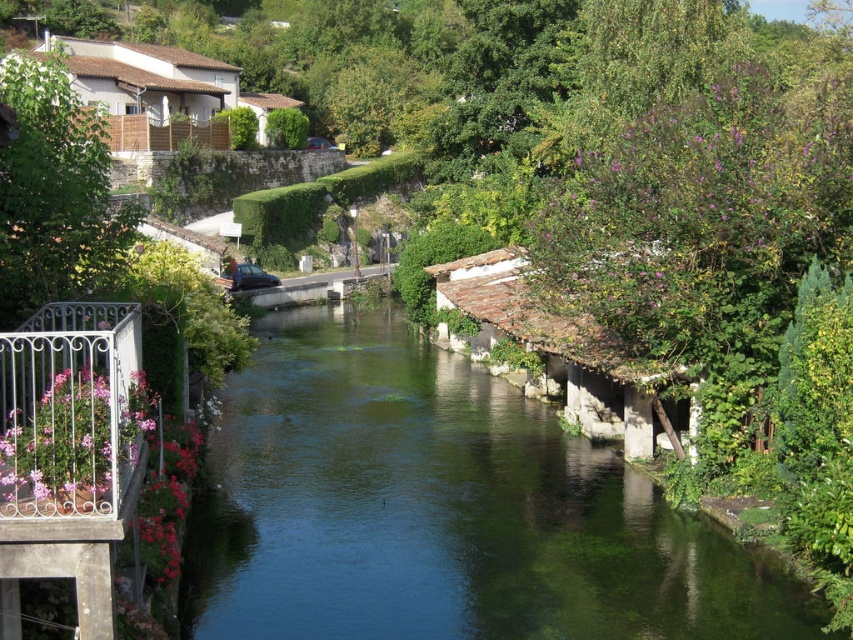
Question: Can you confirm if green stone river at center is smaller than metallic wrought iron balcony at lower left?

Choices:
 (A) yes
 (B) no

Answer: (B)

Question: Which point appears closest to the camera in this image?

Choices:
 (A) (552, 502)
 (B) (13, 346)

Answer: (B)

Question: Where is green stone river at center located in relation to metallic wrought iron balcony at lower left in the image?

Choices:
 (A) right
 (B) left

Answer: (A)

Question: Among these points, which one is farthest from the camera?

Choices:
 (A) (604, 472)
 (B) (74, 340)

Answer: (A)

Question: Is green stone river at center further to the viewer compared to metallic wrought iron balcony at lower left?

Choices:
 (A) yes
 (B) no

Answer: (A)

Question: Which point appears farthest from the camera in this image?

Choices:
 (A) (618, 515)
 (B) (112, 584)

Answer: (A)